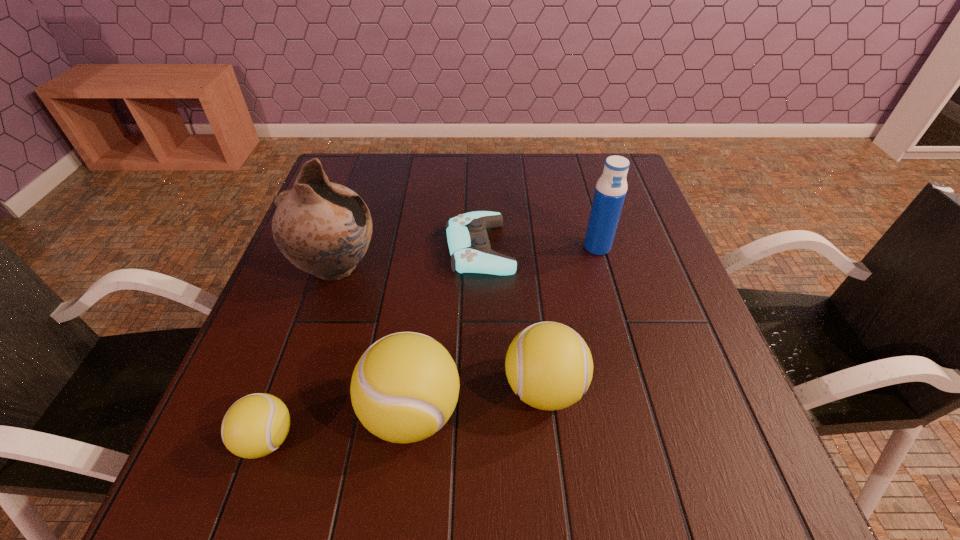
Find the location of a particular element. Image resolution: width=960 pixels, height=540 pixels. the shortest tennis ball is located at coordinates (256, 425).

This screenshot has width=960, height=540. Find the location of `the leftmost tennis ball`. the leftmost tennis ball is located at coordinates (256, 425).

This screenshot has width=960, height=540. What are the coordinates of `the second tennis ball from left to right` in the screenshot? It's located at (404, 388).

I want to click on the third shortest object, so click(x=549, y=365).

Image resolution: width=960 pixels, height=540 pixels. I want to click on the rightmost tennis ball, so click(x=549, y=365).

Identify the location of the shortest object. This screenshot has width=960, height=540. (469, 246).

What are the coordinates of `pottery` in the screenshot? It's located at (323, 228).

Find the location of `the fifth shortest object`. the fifth shortest object is located at coordinates (611, 188).

Locate an element on the screen. This screenshot has width=960, height=540. the rightmost object is located at coordinates (611, 188).

Locate an element on the screen. Image resolution: width=960 pixels, height=540 pixels. free space located 0.250m on the right of the second shortest object is located at coordinates (444, 440).